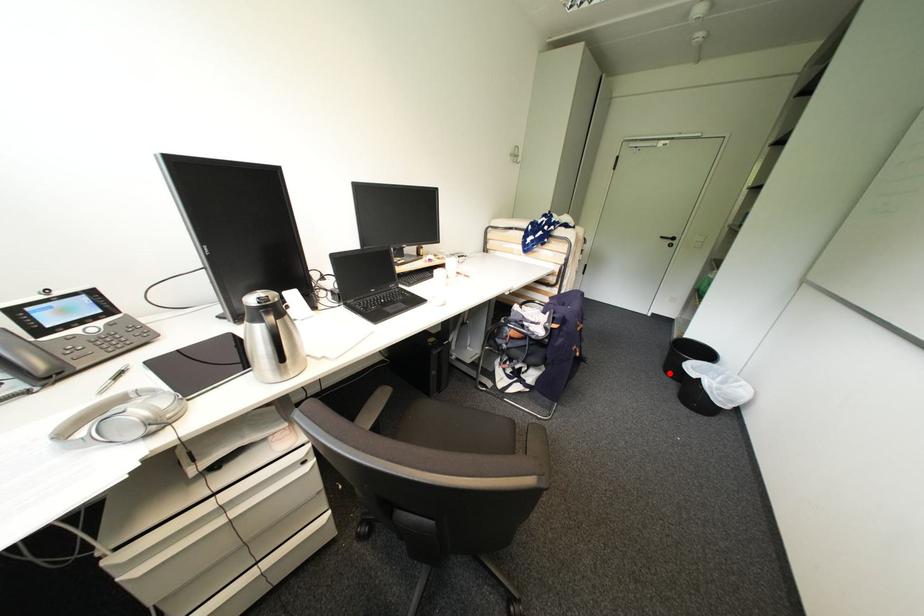
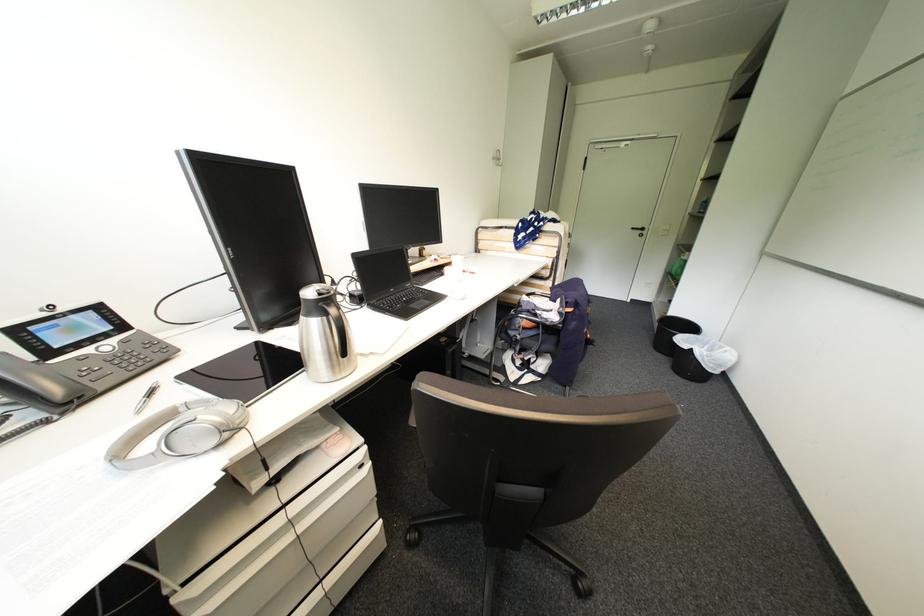
Locate, in the second image, the point that corresponds to the highlighted location in the first image.

(660, 351)